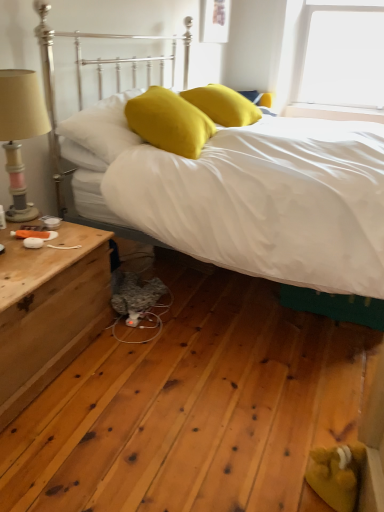
What do you see at coordinates (223, 105) in the screenshot? I see `matte yellow pillow at center, which ranks as the third pillow in left-to-right order` at bounding box center [223, 105].

Measure the distance between point (37, 88) and camera.

Point (37, 88) is 5.40 feet from camera.

The image size is (384, 512). Describe the element at coordinates (336, 306) in the screenshot. I see `white matte bed at center` at that location.

This screenshot has width=384, height=512. Describe the element at coordinates (169, 122) in the screenshot. I see `yellow fabric pillow at center, the 2th pillow when ordered from left to right` at that location.

Describe the element at coordinates (98, 133) in the screenshot. I see `yellow matte pillow at upper left, marked as the 1th pillow in a left-to-right arrangement` at that location.

Find the location of a particular element. The image size is (384, 512). matte yellow pillow at center, which ranks as the third pillow in left-to-right order is located at coordinates (223, 105).

From the picture: Considering the sizes of objects matte yellow pillow at center, the first pillow positioned from the right, and wooden nightstand at left in the image provided, who is bigger, matte yellow pillow at center, the first pillow positioned from the right, or wooden nightstand at left?

wooden nightstand at left is bigger.

Consider the image. Is matte yellow pillow at center, which ranks as the third pillow in left-to-right order, not inside wooden nightstand at left?

matte yellow pillow at center, which ranks as the third pillow in left-to-right order, lies outside wooden nightstand at left's area.

Can you tell me how much matte yellow pillow at center, which ranks as the third pillow in left-to-right order, and wooden nightstand at left differ in facing direction?

2.7 degrees separate the facing orientations of matte yellow pillow at center, which ranks as the third pillow in left-to-right order, and wooden nightstand at left.

In the image, is white matte bed at center positioned in front of or behind wooden beige lampshade at left?

In the image, white matte bed at center appears in front of wooden beige lampshade at left.

Between white matte bed at center and wooden beige lampshade at left, which one has more height?

With more height is white matte bed at center.

Looking at this image, could you tell me if white matte bed at center is turned towards wooden beige lampshade at left?

No, white matte bed at center is not facing towards wooden beige lampshade at left.

Is wooden nightstand at left surrounding yellow fabric pillow at center, the 2th pillow when ordered from left to right?

No, yellow fabric pillow at center, the 2th pillow when ordered from left to right, is not a part of wooden nightstand at left.

Locate an element on the screen. Image resolution: width=384 pixels, height=512 pixels. nightstand lying in front of the yellow fabric pillow at center, the 2th pillow when ordered from left to right is located at coordinates [49, 310].

Is wooden nightstand at left aimed at yellow fabric pillow at center, the 2th pillow when ordered from left to right?

No, wooden nightstand at left is not aimed at yellow fabric pillow at center, the 2th pillow when ordered from left to right.

Is yellow matte pillow at upper left, which is counted as the 3th pillow, starting from the right, shorter than white matte bed at center?

Yes, yellow matte pillow at upper left, which is counted as the 3th pillow, starting from the right, is shorter than white matte bed at center.

Does yellow matte pillow at upper left, which is counted as the 3th pillow, starting from the right, turn towards white matte bed at center?

Yes, yellow matte pillow at upper left, which is counted as the 3th pillow, starting from the right, is oriented towards white matte bed at center.

Can we say yellow matte pillow at upper left, which is counted as the 3th pillow, starting from the right, lies outside white matte bed at center?

No, yellow matte pillow at upper left, which is counted as the 3th pillow, starting from the right, is not outside of white matte bed at center.

Is point (77, 144) positioned in front of point (59, 181)?

Yes, it is in front of point (59, 181).

How much distance is there between yellow fabric pillow at center, the 2th pillow when ordered from left to right, and yellow matte pillow at upper left, marked as the 1th pillow in a left-to-right arrangement?

A distance of 7.36 inches exists between yellow fabric pillow at center, the 2th pillow when ordered from left to right, and yellow matte pillow at upper left, marked as the 1th pillow in a left-to-right arrangement.

Does yellow fabric pillow at center, the second pillow viewed from the right, turn towards yellow matte pillow at upper left, which is counted as the 3th pillow, starting from the right?

No, yellow fabric pillow at center, the second pillow viewed from the right, is not turned towards yellow matte pillow at upper left, which is counted as the 3th pillow, starting from the right.

Do you think yellow fabric pillow at center, the second pillow viewed from the right, is within yellow matte pillow at upper left, marked as the 1th pillow in a left-to-right arrangement, or outside of it?

yellow fabric pillow at center, the second pillow viewed from the right, is outside yellow matte pillow at upper left, marked as the 1th pillow in a left-to-right arrangement.

Is the depth of yellow fabric pillow at center, the 2th pillow when ordered from left to right, greater than that of yellow matte pillow at upper left, marked as the 1th pillow in a left-to-right arrangement?

No, yellow fabric pillow at center, the 2th pillow when ordered from left to right, is closer to the viewer.

Is wooden nightstand at left at the right side of white matte bed at center?

No, wooden nightstand at left is not to the right of white matte bed at center.

Considering the positions of point (67, 313) and point (294, 288), is point (67, 313) closer or farther from the camera than point (294, 288)?

Point (67, 313) appears to be closer to the viewer than point (294, 288).

How distant is wooden nightstand at left from white matte bed at center?

wooden nightstand at left is 23.87 inches from white matte bed at center.

Find the location of `nightstand lying below the white matte bed at center (from the image's perspective)`. nightstand lying below the white matte bed at center (from the image's perspective) is located at coordinates (49, 310).

Is wooden nightstand at left behind yellow matte pillow at upper left, which is counted as the 3th pillow, starting from the right?

That is False.

Identify the location of the 1st pillow above the wooden nightstand at left (from a real-world perspective). The image size is (384, 512). (98, 133).

Between wooden nightstand at left and yellow matte pillow at upper left, marked as the 1th pillow in a left-to-right arrangement, which one has larger size?

wooden nightstand at left.

I want to click on nightstand that appears below the matte yellow pillow at center, the first pillow positioned from the right (from a real-world perspective), so click(49, 310).

The image size is (384, 512). What are the coordinates of `bed on the right of wooden beige lampshade at left` in the screenshot? It's located at (336, 306).

Considering their positions, is matte yellow pillow at center, which ranks as the third pillow in left-to-right order, positioned further to yellow fabric pillow at center, the 2th pillow when ordered from left to right, than white matte bed at center?

The object further to yellow fabric pillow at center, the 2th pillow when ordered from left to right, is matte yellow pillow at center, which ranks as the third pillow in left-to-right order.

Which object lies nearer to the anchor point wooden beige lampshade at left, wooden nightstand at left or matte yellow pillow at center, the first pillow positioned from the right?

Based on the image, wooden nightstand at left appears to be nearer to wooden beige lampshade at left.

From the picture: From the image, which object appears to be nearer to yellow fabric pillow at center, the second pillow viewed from the right, matte yellow pillow at center, the first pillow positioned from the right, or wooden beige lampshade at left?

The object closer to yellow fabric pillow at center, the second pillow viewed from the right, is matte yellow pillow at center, the first pillow positioned from the right.

From the image, which object appears to be nearer to matte yellow pillow at center, the first pillow positioned from the right, wooden beige lampshade at left or white matte bed at center?

white matte bed at center is closer to matte yellow pillow at center, the first pillow positioned from the right.

Which object lies further to the anchor point wooden beige lampshade at left, matte yellow pillow at center, which ranks as the third pillow in left-to-right order, or white matte bed at center?

Among the two, matte yellow pillow at center, which ranks as the third pillow in left-to-right order, is located further to wooden beige lampshade at left.

Considering their positions, is yellow matte pillow at upper left, marked as the 1th pillow in a left-to-right arrangement, positioned closer to matte yellow pillow at center, which ranks as the third pillow in left-to-right order, than wooden nightstand at left?

The object closer to matte yellow pillow at center, which ranks as the third pillow in left-to-right order, is yellow matte pillow at upper left, marked as the 1th pillow in a left-to-right arrangement.

In the scene shown: When comparing their distances from wooden nightstand at left, does yellow matte pillow at upper left, which is counted as the 3th pillow, starting from the right, or wooden beige lampshade at left seem closer?

Based on the image, wooden beige lampshade at left appears to be nearer to wooden nightstand at left.

Estimate the real-world distances between objects in this image. Which object is closer to white matte bed at center, yellow matte pillow at upper left, marked as the 1th pillow in a left-to-right arrangement, or wooden beige lampshade at left?

Based on the image, yellow matte pillow at upper left, marked as the 1th pillow in a left-to-right arrangement, appears to be nearer to white matte bed at center.

The width and height of the screenshot is (384, 512). I want to click on pillow between white matte bed at center and yellow matte pillow at upper left, marked as the 1th pillow in a left-to-right arrangement, along the z-axis, so click(x=169, y=122).

Find the location of a particular element. Image resolution: width=384 pixels, height=512 pixels. table lamp located between wooden nightstand at left and matte yellow pillow at center, the first pillow positioned from the right, in the depth direction is located at coordinates (20, 132).

Find the location of a particular element. table lamp between yellow matte pillow at upper left, which is counted as the 3th pillow, starting from the right, and wooden nightstand at left, in the vertical direction is located at coordinates (20, 132).

At what (x,y) coordinates should I click in order to perform the action: click on nightstand located between wooden beige lampshade at left and white matte bed at center in the left-right direction. Please return your answer as a coordinate pair (x, y). Image resolution: width=384 pixels, height=512 pixels. Looking at the image, I should click on (49, 310).